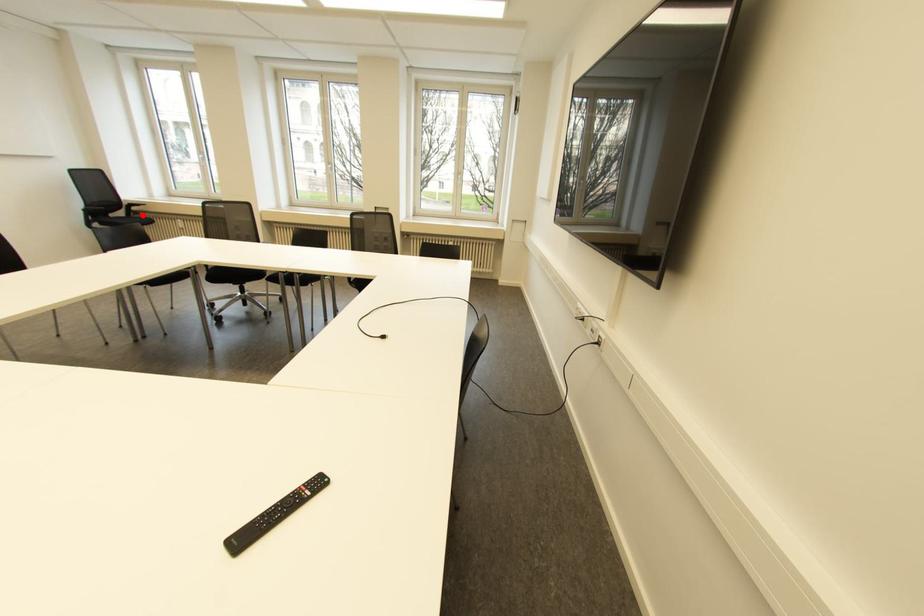
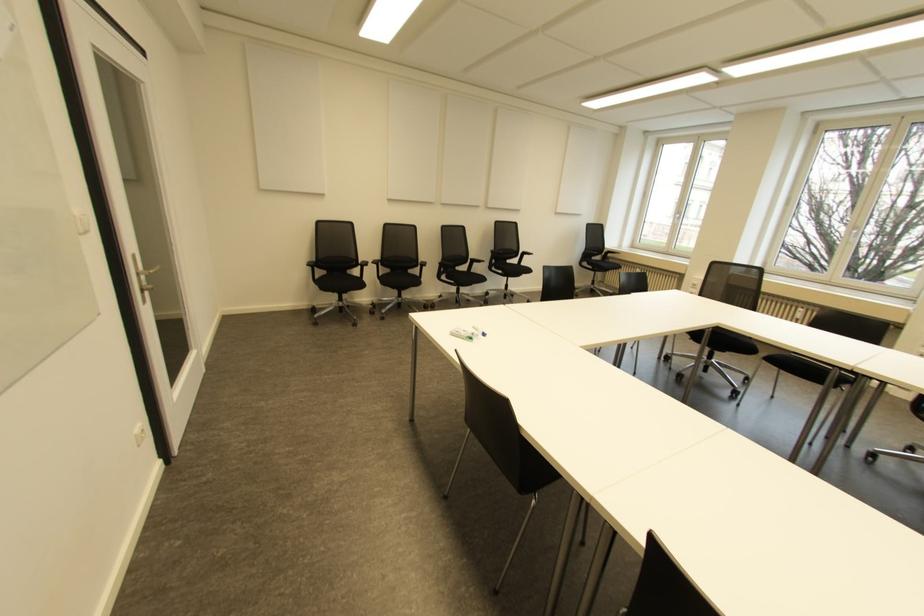
Locate, in the second image, the point that corresponds to the highlighted location in the first image.

(610, 261)